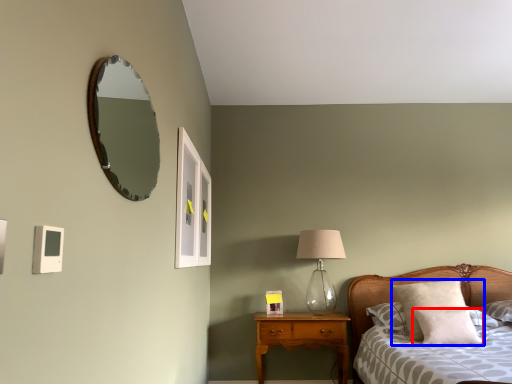
Question: Which point is further to the camera, pillow (highlighted by a red box) or pillow (highlighted by a blue box)?

Choices:
 (A) pillow
 (B) pillow

Answer: (B)